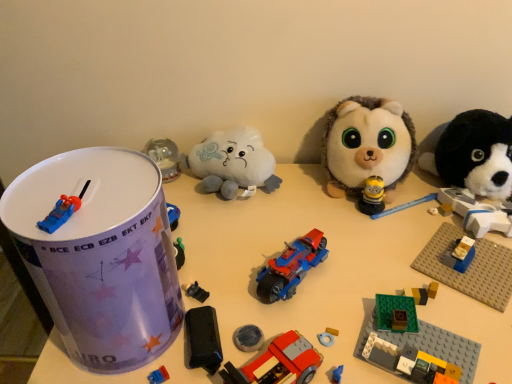
This screenshot has width=512, height=384. Identify the location of vacant space to the right of white plush cloud at center, which appears as the seventh toy when viewed from the right. (305, 199).